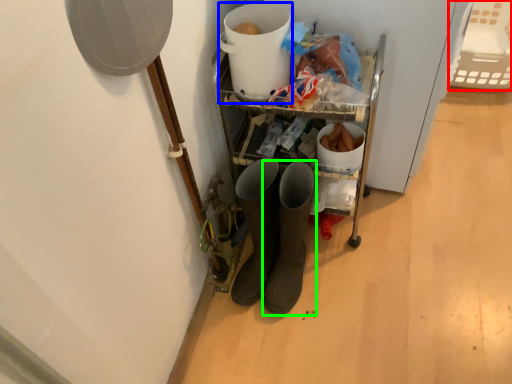
Question: Which object is the closest to the basket (highlighted by a red box)? Choose among these: appliance (highlighted by a blue box) or footwear (highlighted by a green box).

Choices:
 (A) appliance
 (B) footwear

Answer: (A)